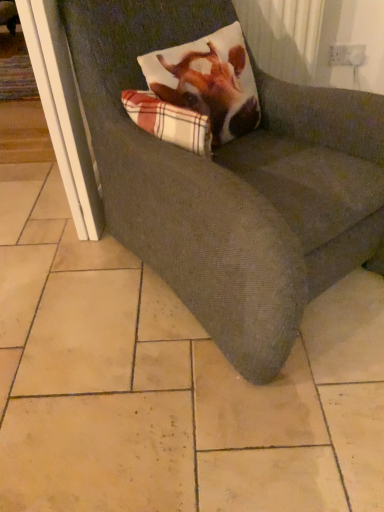
You are a GUI agent. You are given a task and a screenshot of the screen. Output one action in this format:
    pyautogui.click(x=<x>, y=<y>)
    Task: Click on the vacant space in front of textured gray couch at center
    The image size is (384, 512).
    Given the screenshot: What is the action you would take?
    pyautogui.click(x=199, y=412)